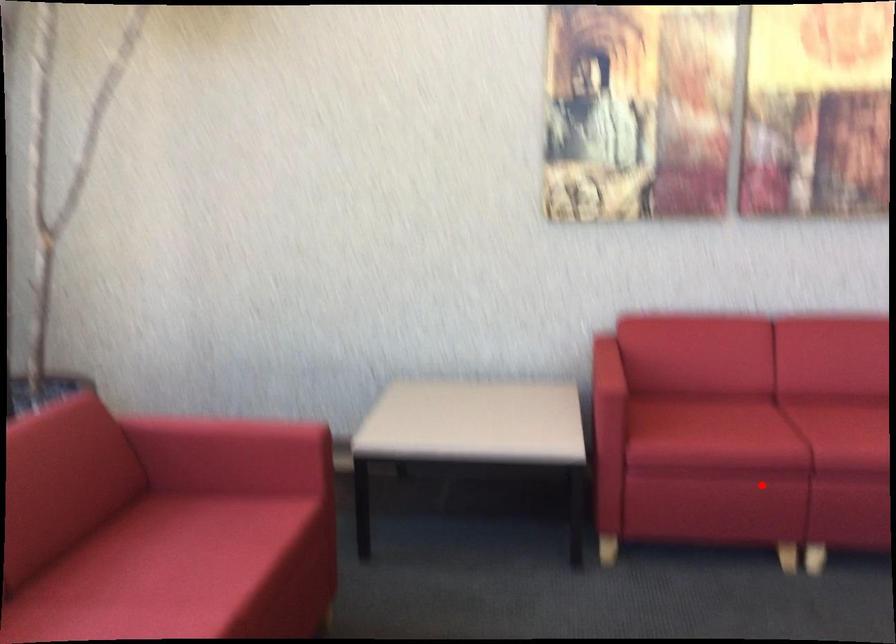
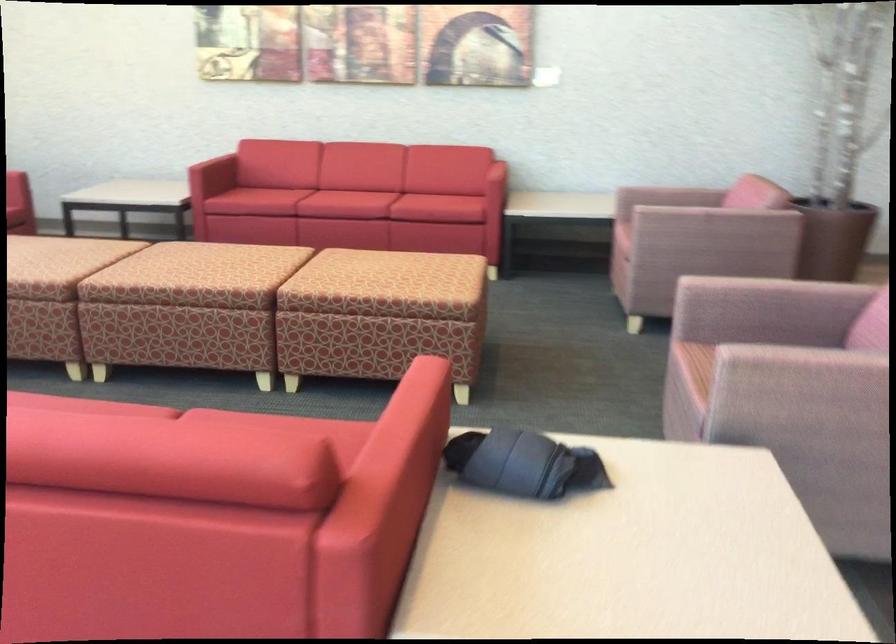
Find the pixel in the second image that matches the highlighted location in the first image.

(265, 200)